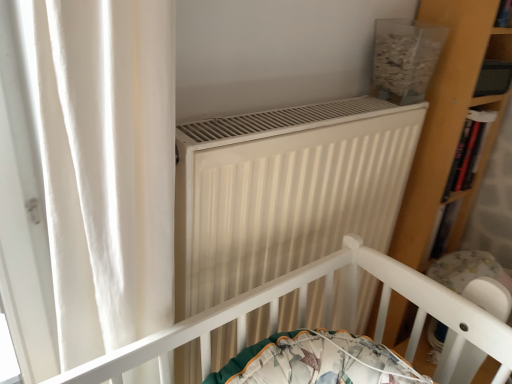
Question: Based on their sizes in the image, would you say white matte radiator at center is bigger or smaller than wooden bookshelf at right?

Choices:
 (A) big
 (B) small

Answer: (A)

Question: Relative to wooden bookshelf at right, is white matte radiator at center in front or behind?

Choices:
 (A) front
 (B) behind

Answer: (A)

Question: Based on their relative distances, which object is nearer to the wooden bookshelf at right?

Choices:
 (A) white matte radiator at center
 (B) white plastic baby carriage at lower right

Answer: (B)

Question: Based on their relative distances, which object is farther from the white plastic baby carriage at lower right?

Choices:
 (A) wooden bookshelf at right
 (B) white matte radiator at center

Answer: (B)